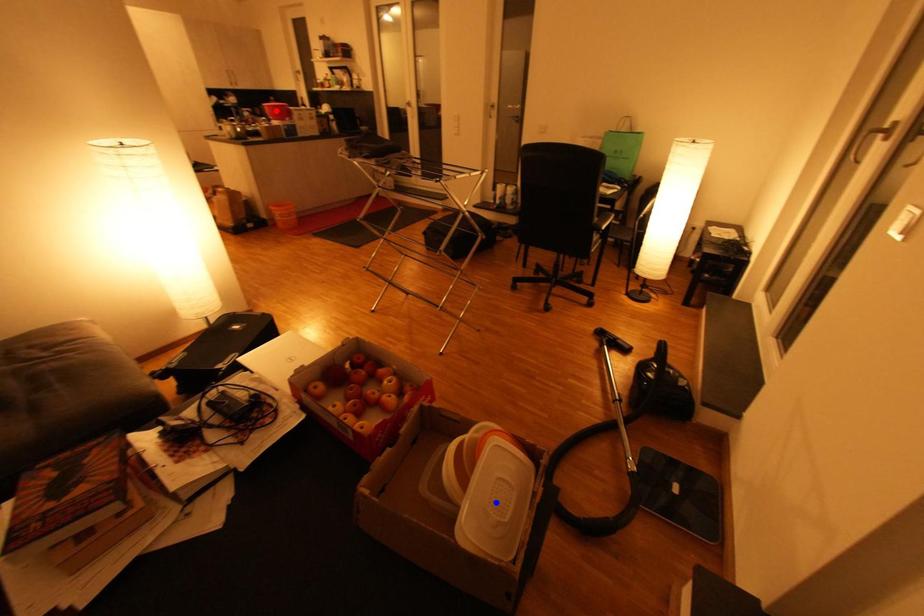
Question: In the image, two points are highlighted. Which point is nearer to the camera? Reply with the corresponding letter.

Choices:
 (A) blue point
 (B) red point

Answer: (A)